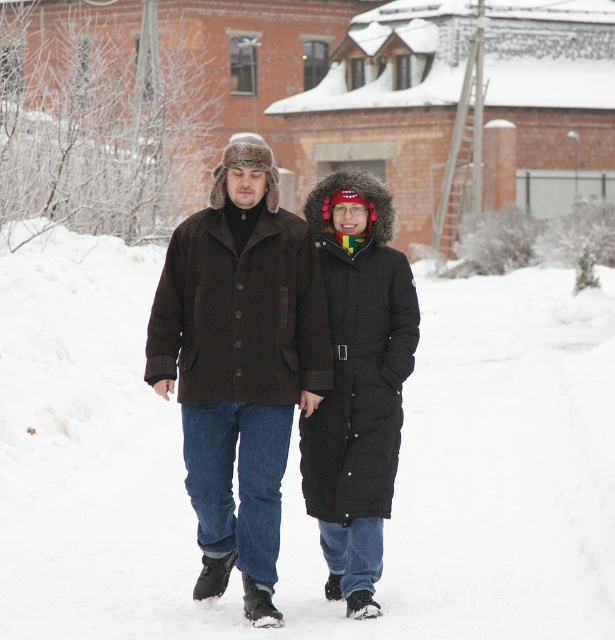
You are a photographer standing behind the two people in the snowy landscape. You want to capture a photo where the white fluffy snow at center is visible above the dark brown wool coat at center. Is this possible based on their current positions?

Yes, because the white fluffy snow at center is taller than the dark brown wool coat at center, so the snow will naturally appear above the coat in the photo.

Based on the photo, you are standing in the snowy landscape and want to place a small flag at the point closer to you. Which point should you choose between point (204, 445) and point (315, 202)?

You should choose point (204, 445) because it is closer to the camera than point (315, 202).

You are standing at the point where the two people are walking in the snowy landscape. Looking towards the brick building with a sloped roof, can you tell me what is at the specific point marked as point (298, 465)?

The white fluffy snow at center is located at point (298, 465).